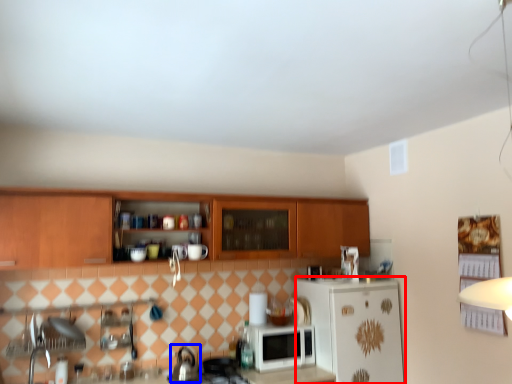
Question: Which object appears farthest to the camera in this image, refrigerator (highlighted by a red box) or tea pot (highlighted by a blue box)?

Choices:
 (A) refrigerator
 (B) tea pot

Answer: (A)